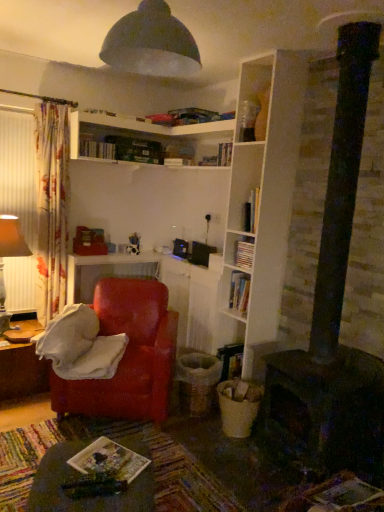
Identify the location of free location in front of wooden board game at lower center, which is counted as the third book, starting from the top. The image size is (384, 512). (92, 500).